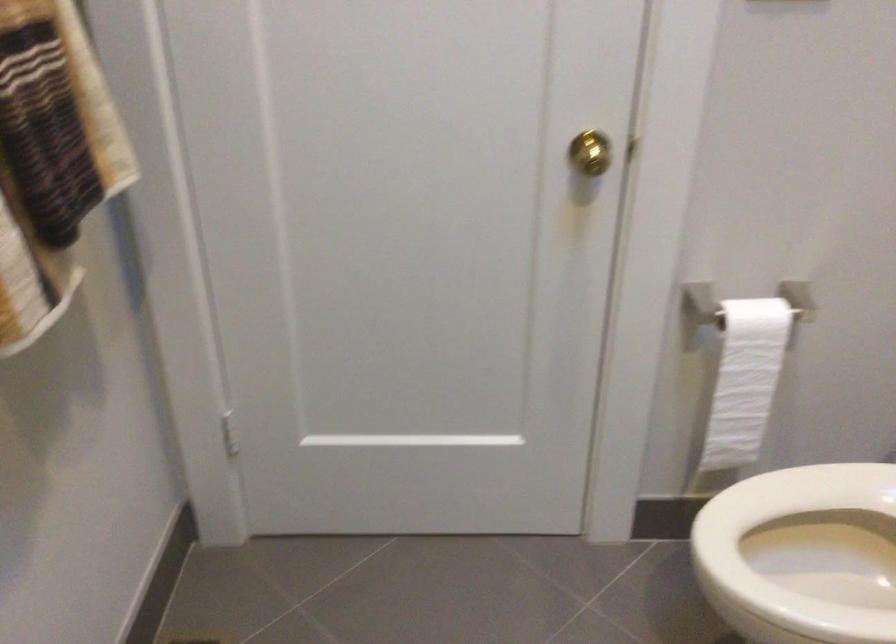
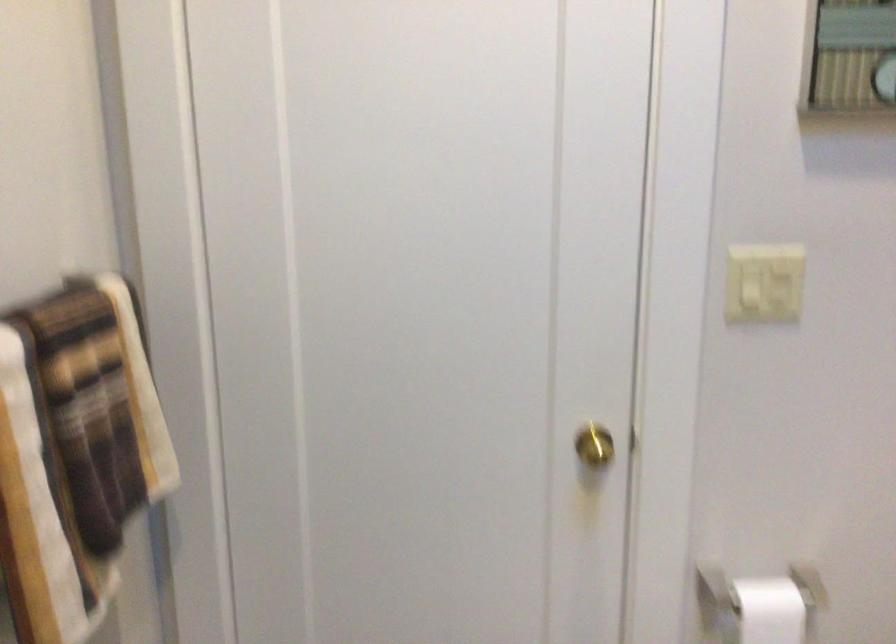
Question: How did the camera likely rotate?

Choices:
 (A) Left
 (B) Right
 (C) Up
 (D) Down

Answer: (C)